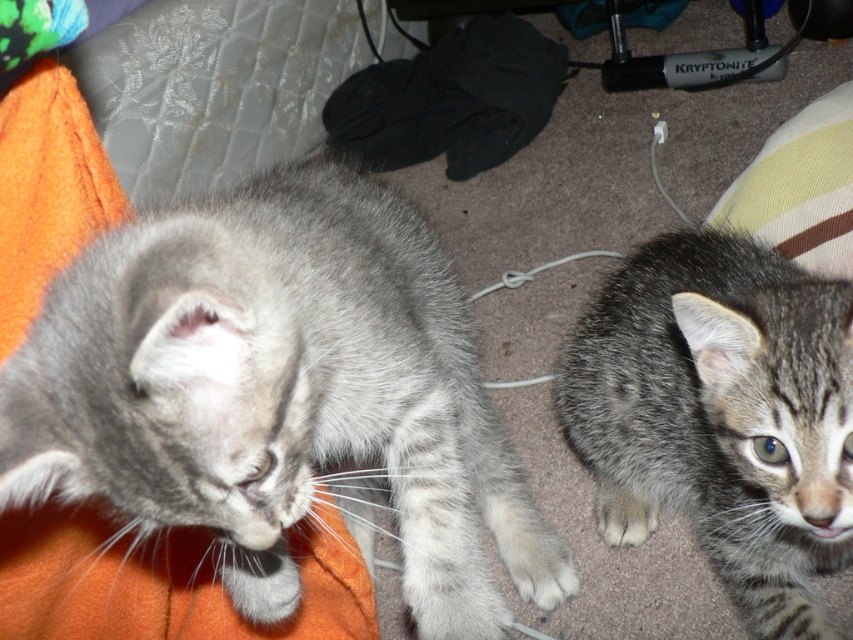
Which of these two, gray tabby cat at left or fuzzy gray cat at upper left, stands taller?

With more height is fuzzy gray cat at upper left.

Is gray tabby cat at left bigger than fuzzy gray cat at upper left?

Yes.

Is point (12, 364) closer to camera compared to point (154, 70)?

Yes.

This screenshot has width=853, height=640. I want to click on gray tabby cat at left, so click(x=277, y=392).

Can you confirm if fuzzy gray cat at upper left is bigger than white fur at lower right?

Indeed, fuzzy gray cat at upper left has a larger size compared to white fur at lower right.

Who is more distant from viewer, (178, 6) or (643, 515)?

Point (178, 6)

Find the location of a particular element. fuzzy gray cat at upper left is located at coordinates (213, 88).

Does tabby fur cat at center appear over fuzzy gray cat at upper left?

No, tabby fur cat at center is not above fuzzy gray cat at upper left.

What do you see at coordinates (724, 410) in the screenshot? This screenshot has height=640, width=853. I see `tabby fur cat at center` at bounding box center [724, 410].

You are a GUI agent. You are given a task and a screenshot of the screen. Output one action in this format:
    pyautogui.click(x=<x>, y=<y>)
    Task: Click on the tabby fur cat at center
    The width and height of the screenshot is (853, 640).
    Given the screenshot: What is the action you would take?
    pyautogui.click(x=724, y=410)